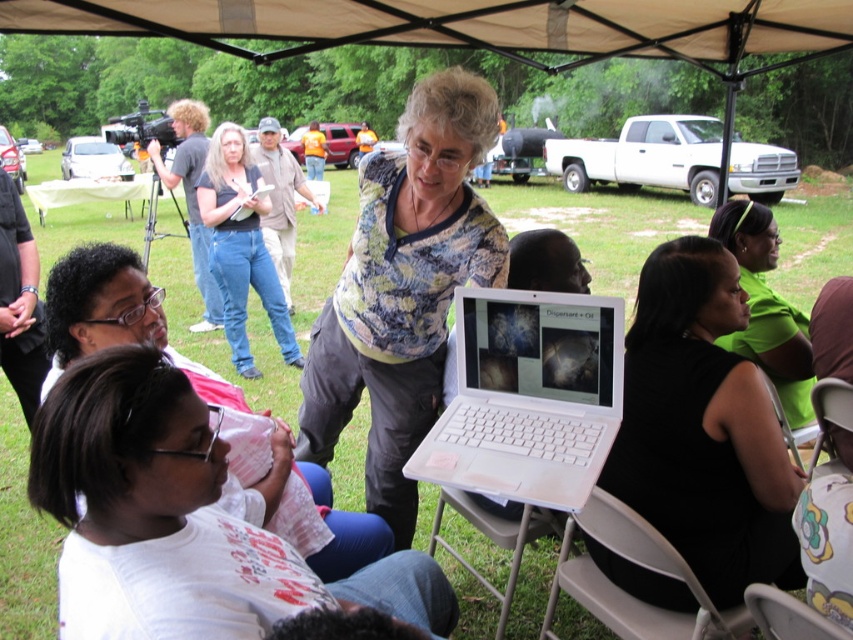
Question: Can you confirm if gray plastic chair at lower center is positioned to the right of gray plastic chair at lower right?

Choices:
 (A) no
 (B) yes

Answer: (A)

Question: Which point is farther to the camera?

Choices:
 (A) (93, 278)
 (B) (567, 586)
 (C) (460, 163)

Answer: (B)

Question: Is floral-patterned shirt at center to the right of gray plastic chair at lower right from the viewer's perspective?

Choices:
 (A) yes
 (B) no

Answer: (B)

Question: Which object is farther from the camera taking this photo?

Choices:
 (A) white matte shirt at center
 (B) tan fabric canopy at upper center
 (C) green matte shirt at upper right

Answer: (B)

Question: From the image, what is the correct spatial relationship of white plastic laptop at center in relation to green matte shirt at upper right?

Choices:
 (A) left
 (B) right

Answer: (A)

Question: Which object is positioned closest to the white matte shirt at center?

Choices:
 (A) gray plastic chair at lower right
 (B) gray plastic chair at lower center

Answer: (B)